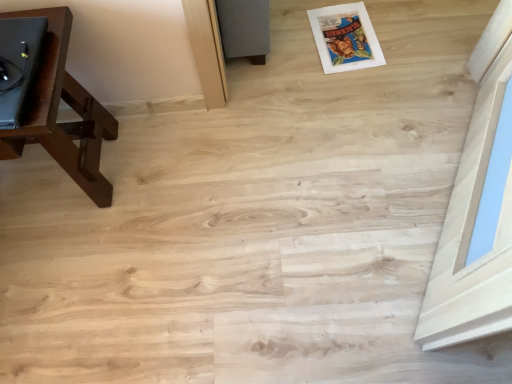
The width and height of the screenshot is (512, 384). In order to click on vacant space in front of brown wood tv stand at left in this screenshot , I will do `click(72, 269)`.